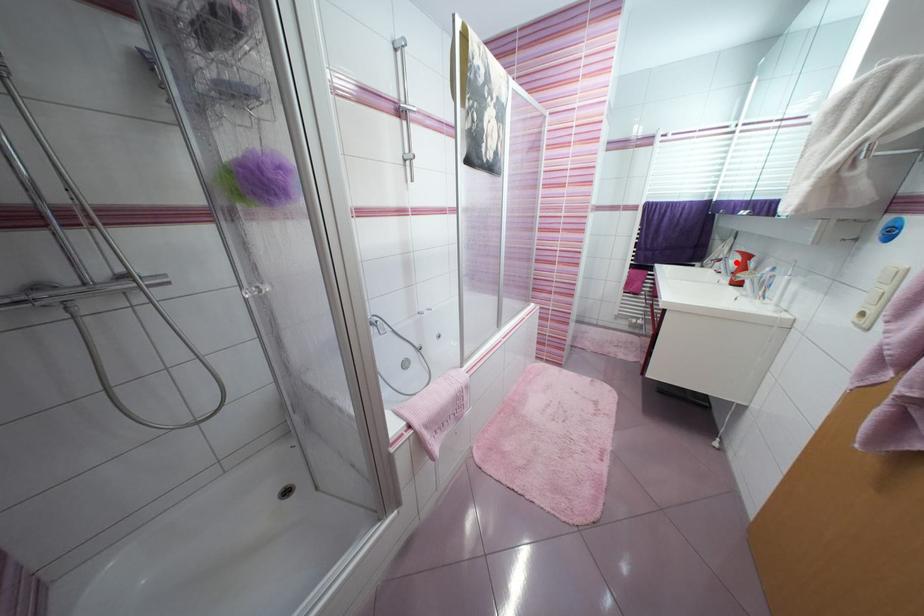
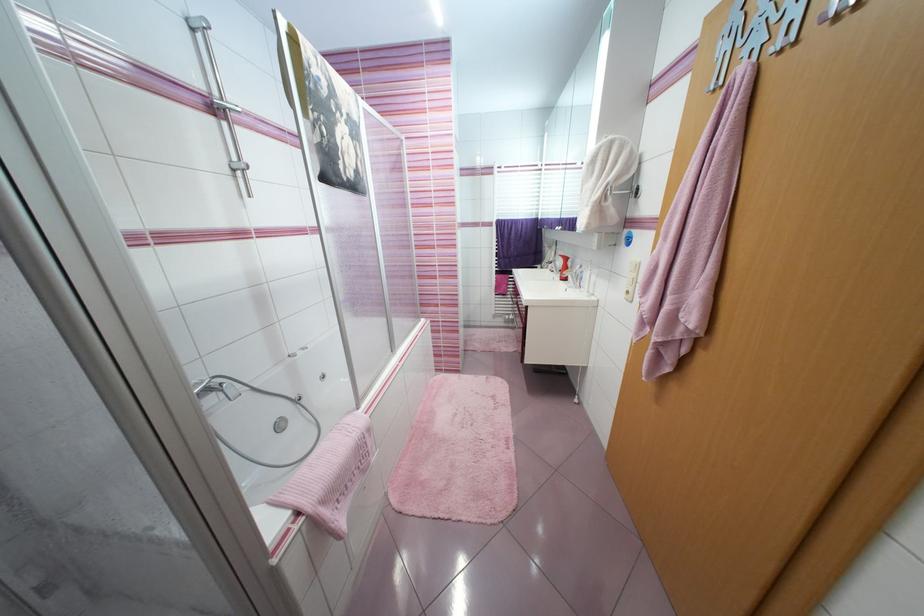
Where in the second image is the point corresponding to the highlighted location from the first image?

(563, 264)